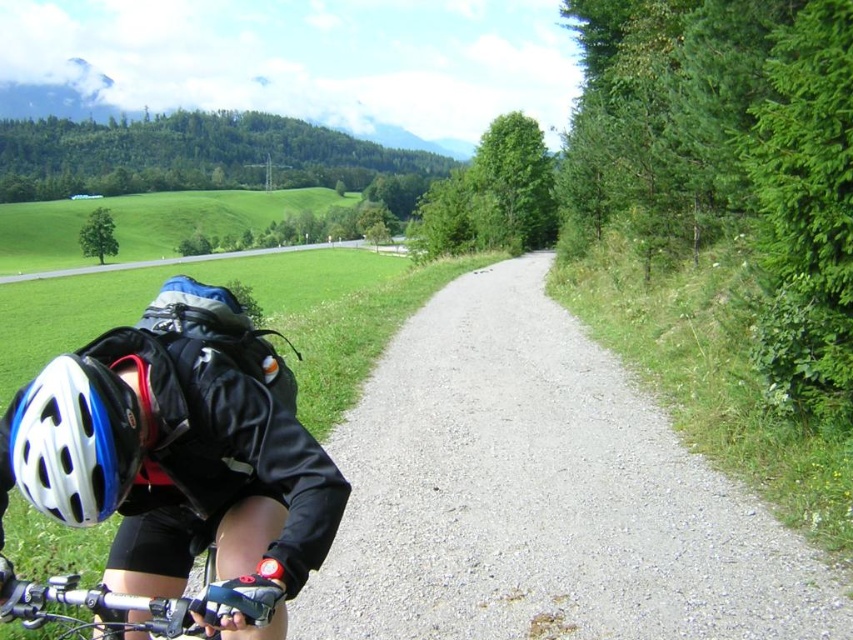
Between gray gravel path at center and white matte bicycle helmet at lower left, which one appears on the left side from the viewer's perspective?

white matte bicycle helmet at lower left

Describe the element at coordinates (543, 497) in the screenshot. I see `gray gravel path at center` at that location.

Find the location of a particular element. This screenshot has height=640, width=853. gray gravel path at center is located at coordinates (543, 497).

From the picture: Which of these two, white matte bicycle helmet at lower left or black matte gloves at lower center, stands shorter?

white matte bicycle helmet at lower left is shorter.

At what (x,y) coordinates should I click in order to perform the action: click on white matte bicycle helmet at lower left. Please return your answer as a coordinate pair (x, y). The width and height of the screenshot is (853, 640). Looking at the image, I should click on (74, 440).

Find the location of a particular element. Image resolution: width=853 pixels, height=640 pixels. gray gravel path at center is located at coordinates (543, 497).

Between gray gravel path at center and black matte gloves at lower center, which one is positioned lower?

gray gravel path at center is below.

Who is more forward, (535, 301) or (165, 625)?

Positioned in front is point (165, 625).

At what (x,y) coordinates should I click in order to perform the action: click on gray gravel path at center. Please return your answer as a coordinate pair (x, y). Looking at the image, I should click on (543, 497).